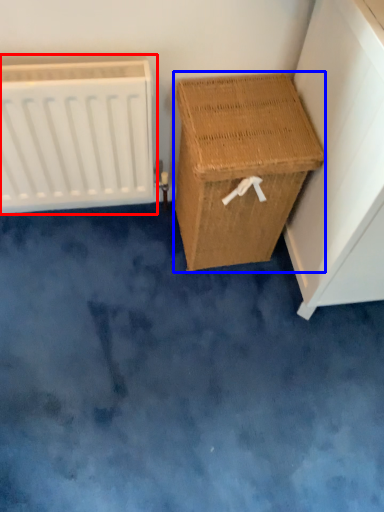
Question: Which of the following is the closest to the observer, radiator (highlighted by a red box) or furniture (highlighted by a blue box)?

Choices:
 (A) radiator
 (B) furniture

Answer: (A)